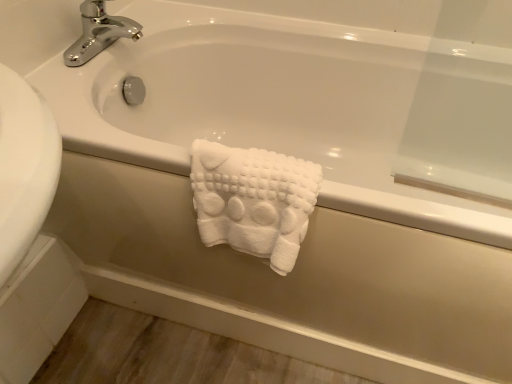
You are a GUI agent. You are given a task and a screenshot of the screen. Output one action in this format:
    pyautogui.click(x=<x>, y=<y>)
    Task: Click on the chrome/metallic faucet at upper left
    The image size is (512, 384).
    Given the screenshot: What is the action you would take?
    pyautogui.click(x=99, y=32)

Image resolution: width=512 pixels, height=384 pixels. What do you see at coordinates (99, 32) in the screenshot?
I see `chrome/metallic faucet at upper left` at bounding box center [99, 32].

This screenshot has height=384, width=512. What do you see at coordinates (253, 200) in the screenshot?
I see `white fluffy towel at center` at bounding box center [253, 200].

You are a GUI agent. You are given a task and a screenshot of the screen. Output one action in this format:
    pyautogui.click(x=<x>, y=<y>)
    Task: Click on the white fluffy towel at center
    
    Given the screenshot: What is the action you would take?
    pyautogui.click(x=253, y=200)

The width and height of the screenshot is (512, 384). Find the location of `chrome/metallic faucet at upper left`. chrome/metallic faucet at upper left is located at coordinates (99, 32).

Does white fluffy towel at center appear on the left side of chrome/metallic faucet at upper left?

No.

Which is in front, white fluffy towel at center or chrome/metallic faucet at upper left?

white fluffy towel at center is closer to the camera.

Which is closer to the camera, (x=290, y=221) or (x=137, y=38)?

The point (x=290, y=221) is more forward.

From the image's perspective, which is above, white fluffy towel at center or chrome/metallic faucet at upper left?

chrome/metallic faucet at upper left appears higher in the image.

From a real-world perspective, is white fluffy towel at center over chrome/metallic faucet at upper left?

No, from a real-world perspective, white fluffy towel at center is not above chrome/metallic faucet at upper left.

Is white fluffy towel at center wider than chrome/metallic faucet at upper left?

No, white fluffy towel at center is not wider than chrome/metallic faucet at upper left.

Is white fluffy towel at center taller than chrome/metallic faucet at upper left?

Correct, white fluffy towel at center is much taller as chrome/metallic faucet at upper left.

Does white fluffy towel at center have a smaller size compared to chrome/metallic faucet at upper left?

No.

In the scene shown: Is white fluffy towel at center not within chrome/metallic faucet at upper left?

That's correct, white fluffy towel at center is outside of chrome/metallic faucet at upper left.

Is white fluffy towel at center far from chrome/metallic faucet at upper left?

Actually, white fluffy towel at center and chrome/metallic faucet at upper left are a little close together.

Is white fluffy towel at center turned away from chrome/metallic faucet at upper left?

No.

Can you tell me how much white fluffy towel at center and chrome/metallic faucet at upper left differ in facing direction?

The angular difference between white fluffy towel at center and chrome/metallic faucet at upper left is 86.5 degrees.

In the scene shown: Measure the distance between white fluffy towel at center and chrome/metallic faucet at upper left.

22.30 inches.

The height and width of the screenshot is (384, 512). Identify the location of tap lying behind the white fluffy towel at center. (99, 32).

In the image, is chrome/metallic faucet at upper left on the left side or the right side of white fluffy towel at center?

In the image, chrome/metallic faucet at upper left appears on the left side of white fluffy towel at center.

In the scene shown: Considering their positions, is chrome/metallic faucet at upper left located in front of or behind white fluffy towel at center?

In the image, chrome/metallic faucet at upper left appears behind white fluffy towel at center.

Which point is more forward, (102, 8) or (291, 267)?

Point (291, 267)

From the image's perspective, is chrome/metallic faucet at upper left on top of white fluffy towel at center?

Yes, from the image's perspective, chrome/metallic faucet at upper left is over white fluffy towel at center.

From a real-world perspective, which object rests below the other?

white fluffy towel at center, from a real-world perspective.

Considering the relative sizes of chrome/metallic faucet at upper left and white fluffy towel at center in the image provided, is chrome/metallic faucet at upper left wider than white fluffy towel at center?

Yes, chrome/metallic faucet at upper left is wider than white fluffy towel at center.

Which of these two, chrome/metallic faucet at upper left or white fluffy towel at center, stands taller?

white fluffy towel at center.

Which of these two, chrome/metallic faucet at upper left or white fluffy towel at center, is bigger?

Bigger between the two is white fluffy towel at center.

Would you say chrome/metallic faucet at upper left is inside or outside white fluffy towel at center?

chrome/metallic faucet at upper left is located beyond the bounds of white fluffy towel at center.

Looking at this image, are chrome/metallic faucet at upper left and white fluffy towel at center located far from each other?

No, chrome/metallic faucet at upper left is in close proximity to white fluffy towel at center.

Could you tell me if chrome/metallic faucet at upper left is facing white fluffy towel at center?

No, chrome/metallic faucet at upper left is not facing towards white fluffy towel at center.

The width and height of the screenshot is (512, 384). I want to click on towel that is in front of the chrome/metallic faucet at upper left, so click(x=253, y=200).

Where is `towel lying below the chrome/metallic faucet at upper left (from the image's perspective)`? Image resolution: width=512 pixels, height=384 pixels. towel lying below the chrome/metallic faucet at upper left (from the image's perspective) is located at coordinates tap(253, 200).

Where is `towel in front of the chrome/metallic faucet at upper left`? Image resolution: width=512 pixels, height=384 pixels. towel in front of the chrome/metallic faucet at upper left is located at coordinates (253, 200).